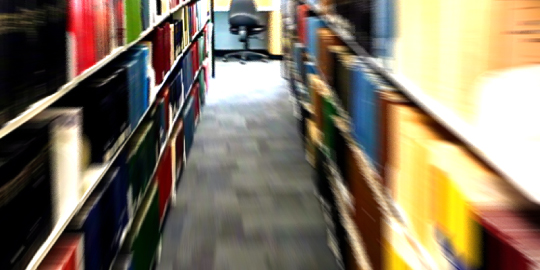
Locate an element on the screen. red books is located at coordinates (87, 36), (161, 47), (164, 169), (371, 203), (499, 223).